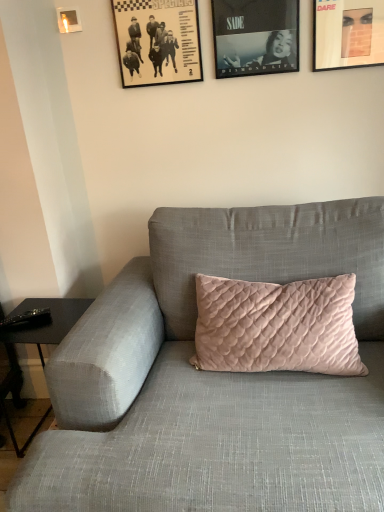
Question: Is matte black picture frame at upper center, marked as the 3th picture frame in a left-to-right arrangement, at the left side of black paper picture frame at upper center, the 2th picture frame in the left-to-right sequence?

Choices:
 (A) no
 (B) yes

Answer: (A)

Question: Is black paper picture frame at upper center, arranged as the 3th picture frame when viewed from the right, at the back of matte black picture frame at upper center, which is the 2th picture frame in right-to-left order?

Choices:
 (A) yes
 (B) no

Answer: (B)

Question: Could black paper picture frame at upper center, arranged as the 3th picture frame when viewed from the right, be considered to be inside matte black picture frame at upper center, marked as the 3th picture frame in a left-to-right arrangement?

Choices:
 (A) no
 (B) yes

Answer: (A)

Question: Would you say matte black picture frame at upper center, which is the 2th picture frame in right-to-left order, is outside black paper picture frame at upper center, the 2th picture frame in the left-to-right sequence?

Choices:
 (A) no
 (B) yes

Answer: (B)

Question: Is matte black picture frame at upper center, marked as the 3th picture frame in a left-to-right arrangement, smaller than black paper picture frame at upper center, arranged as the 3th picture frame when viewed from the right?

Choices:
 (A) no
 (B) yes

Answer: (B)

Question: Can you confirm if matte black picture frame at upper center, marked as the 3th picture frame in a left-to-right arrangement, is taller than black paper picture frame at upper center, arranged as the 3th picture frame when viewed from the right?

Choices:
 (A) no
 (B) yes

Answer: (A)

Question: From a real-world perspective, is matte black picture frame at upper center, which is the 2th picture frame in right-to-left order, physically below matte black picture frame at upper right, which ranks as the 4th picture frame in left-to-right order?

Choices:
 (A) yes
 (B) no

Answer: (B)

Question: Can we say matte black picture frame at upper center, which is the 2th picture frame in right-to-left order, lies outside matte black picture frame at upper right, which ranks as the 4th picture frame in left-to-right order?

Choices:
 (A) yes
 (B) no

Answer: (A)

Question: Is matte black picture frame at upper center, which is the 2th picture frame in right-to-left order, taller than matte black picture frame at upper right, placed as the first picture frame when sorted from right to left?

Choices:
 (A) yes
 (B) no

Answer: (B)

Question: Does matte black picture frame at upper center, which is the 2th picture frame in right-to-left order, come behind matte black picture frame at upper right, placed as the first picture frame when sorted from right to left?

Choices:
 (A) yes
 (B) no

Answer: (A)

Question: Does matte black picture frame at upper center, which is the 2th picture frame in right-to-left order, have a lesser width compared to matte black picture frame at upper right, which ranks as the 4th picture frame in left-to-right order?

Choices:
 (A) yes
 (B) no

Answer: (A)

Question: Does matte black picture frame at upper center, which is the 2th picture frame in right-to-left order, contain matte black picture frame at upper right, placed as the first picture frame when sorted from right to left?

Choices:
 (A) yes
 (B) no

Answer: (B)

Question: Is matte black picture frame at upper center, marked as the 3th picture frame in a left-to-right arrangement, not near velvet pink pillow at center?

Choices:
 (A) yes
 (B) no

Answer: (B)